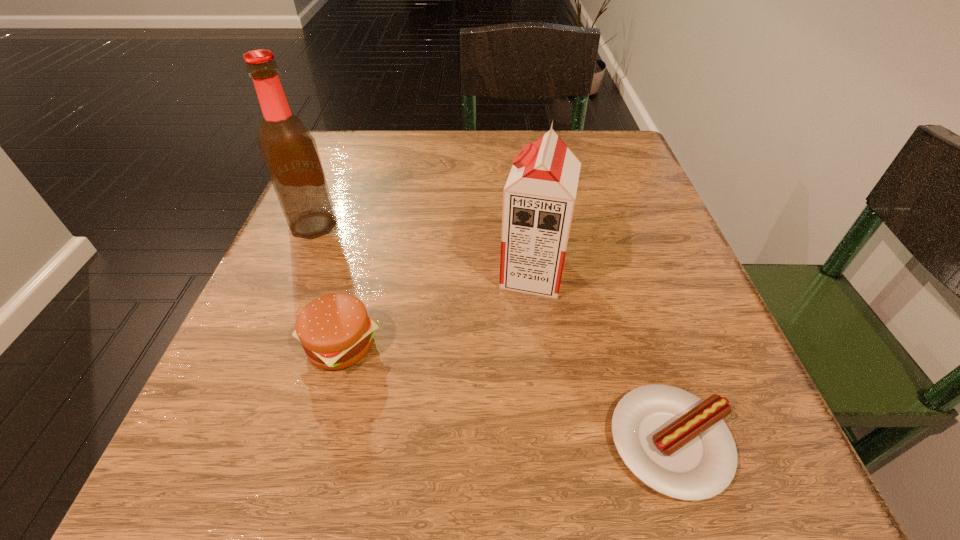
Find the location of a particular element. vacant space that satisfies the following two spatial constraints: 1. on the front side of the third nearest object; 2. on the right side of the farthest object is located at coordinates (293, 274).